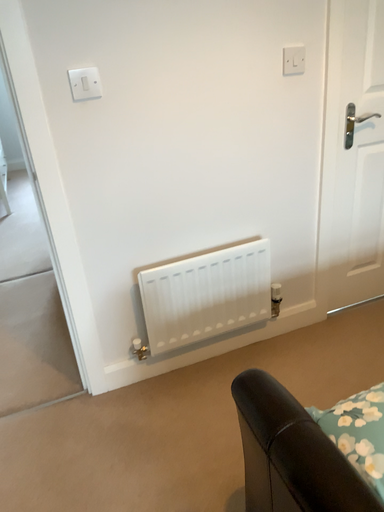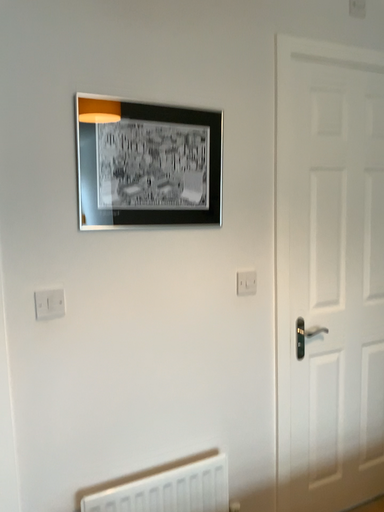
Question: How did the camera likely rotate when shooting the video?

Choices:
 (A) rotated upward
 (B) rotated downward

Answer: (A)